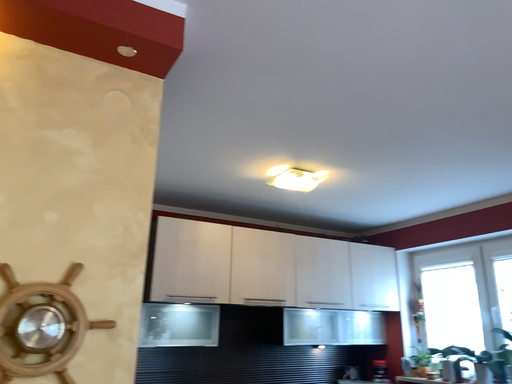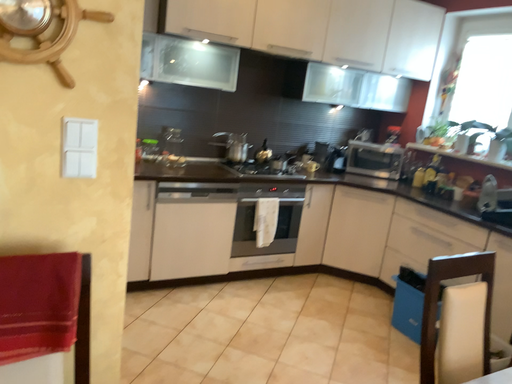
Question: Which way did the camera rotate in the video?

Choices:
 (A) rotated downward
 (B) rotated upward

Answer: (A)